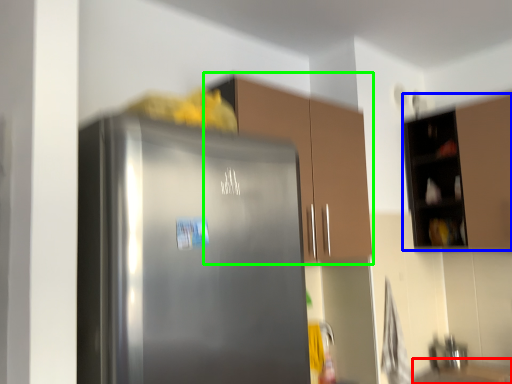
Question: Based on their relative distances, which object is nearer to counter top (highlighted by a red box)? Choose from cabinetry (highlighted by a blue box) and cabinetry (highlighted by a green box).

Choices:
 (A) cabinetry
 (B) cabinetry

Answer: (A)